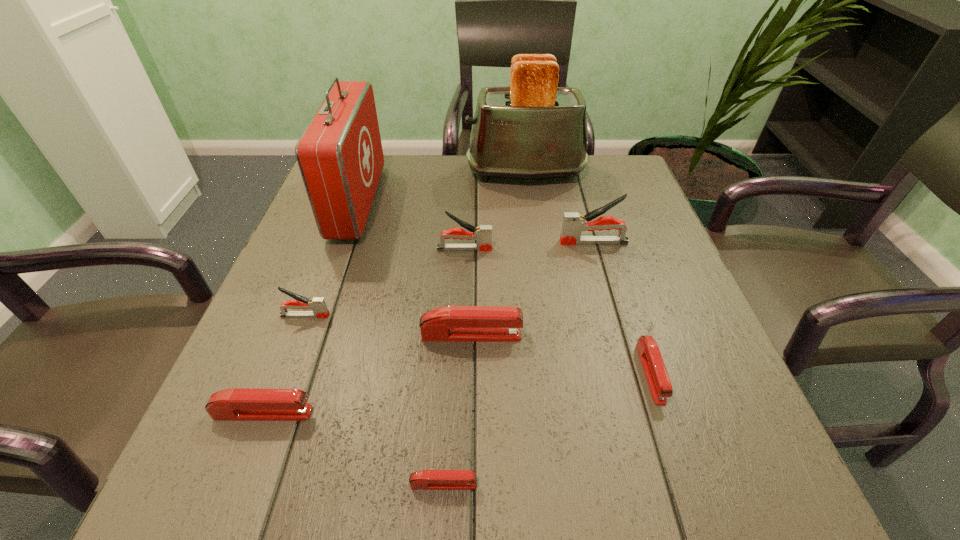
Identify the location of object that can be found as the third closest to the nearest object. (660, 386).

The width and height of the screenshot is (960, 540). I want to click on object that ranks as the eighth closest to the second gray stapler from right to left, so click(x=426, y=479).

This screenshot has width=960, height=540. I want to click on stapler identified as the fifth closest to the smallest gray stapler, so click(573, 224).

The height and width of the screenshot is (540, 960). Find the location of `stapler that is the closest to the fourth nearest object`. stapler that is the closest to the fourth nearest object is located at coordinates (318, 306).

Identify which gray stapler is located as the second nearest to the nearest gray stapler. Please provide its 2D coordinates. Your answer should be formatted as a tuple, i.e. [(x, y)], where the tuple contains the x and y coordinates of a point satisfying the conditions above.

[(573, 224)]

Point out which gray stapler is positioned as the nearest to the seventh shortest object. Please provide its 2D coordinates. Your answer should be formatted as a tuple, i.e. [(x, y)], where the tuple contains the x and y coordinates of a point satisfying the conditions above.

[(483, 235)]

Locate an element on the screen. This screenshot has width=960, height=540. red stapler object that ranks as the second closest to the sixth shortest stapler is located at coordinates (660, 386).

Point out which red stapler is positioned as the third nearest to the red first-aid kit. Please provide its 2D coordinates. Your answer should be formatted as a tuple, i.e. [(x, y)], where the tuple contains the x and y coordinates of a point satisfying the conditions above.

[(426, 479)]